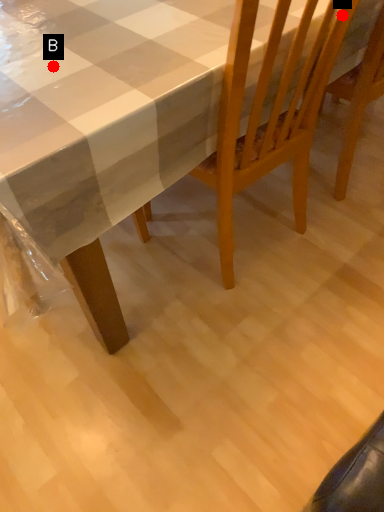
Question: Two points are circled on the image, labeled by A and B beside each circle. Which point appears farthest from the camera in this image?

Choices:
 (A) A is further
 (B) B is further

Answer: (A)